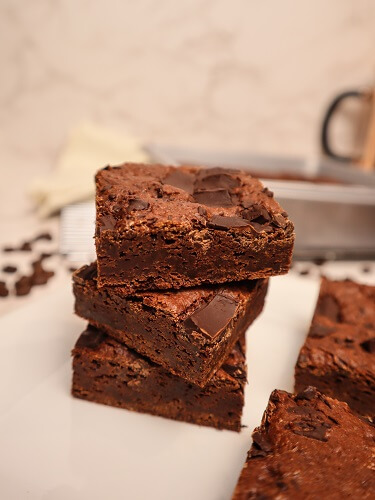
Locate an element on the screen. This screenshot has height=500, width=375. crumb is located at coordinates (245, 425).